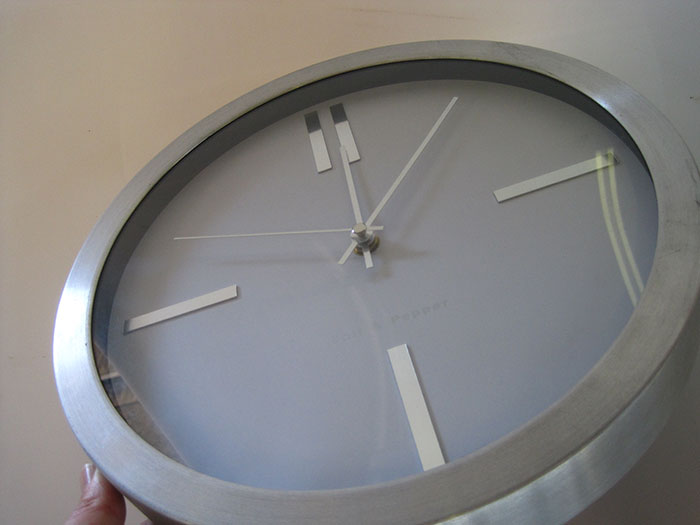
The width and height of the screenshot is (700, 525). I want to click on clock, so click(385, 295).